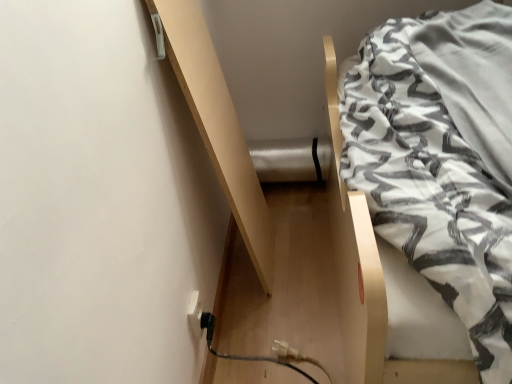
Question: Considering the positions of white textured fabric at upper right and light wood shelf at upper left in the image, is white textured fabric at upper right taller or shorter than light wood shelf at upper left?

Choices:
 (A) tall
 (B) short

Answer: (B)

Question: From the image's perspective, is white textured fabric at upper right above or below light wood shelf at upper left?

Choices:
 (A) above
 (B) below

Answer: (B)

Question: Which object is positioned closest to the white textured fabric at upper right?

Choices:
 (A) light wood shelf at upper left
 (B) white plastic electric outlet at lower left

Answer: (A)

Question: Which of these objects is positioned closest to the light wood shelf at upper left?

Choices:
 (A) white plastic electric outlet at lower left
 (B) white textured fabric at upper right

Answer: (A)